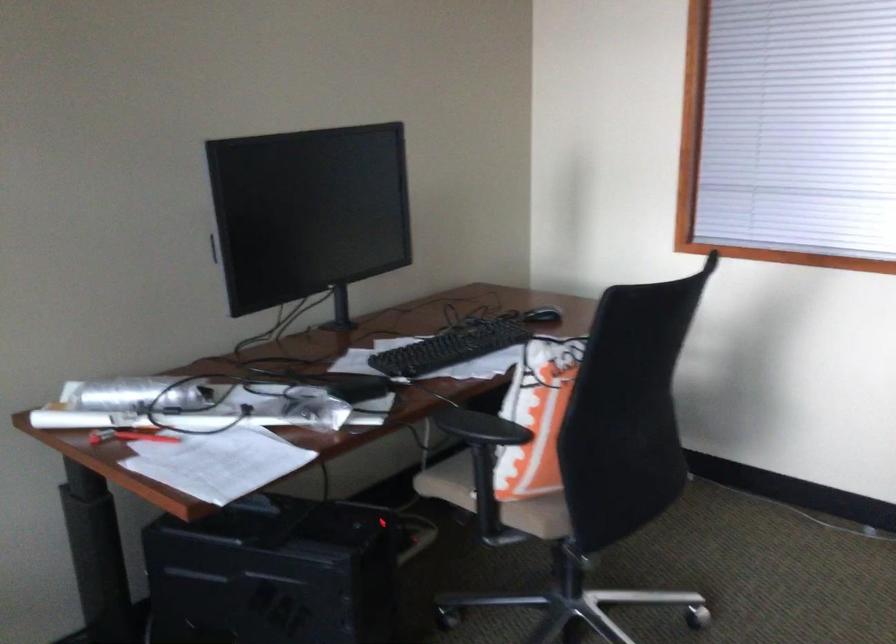
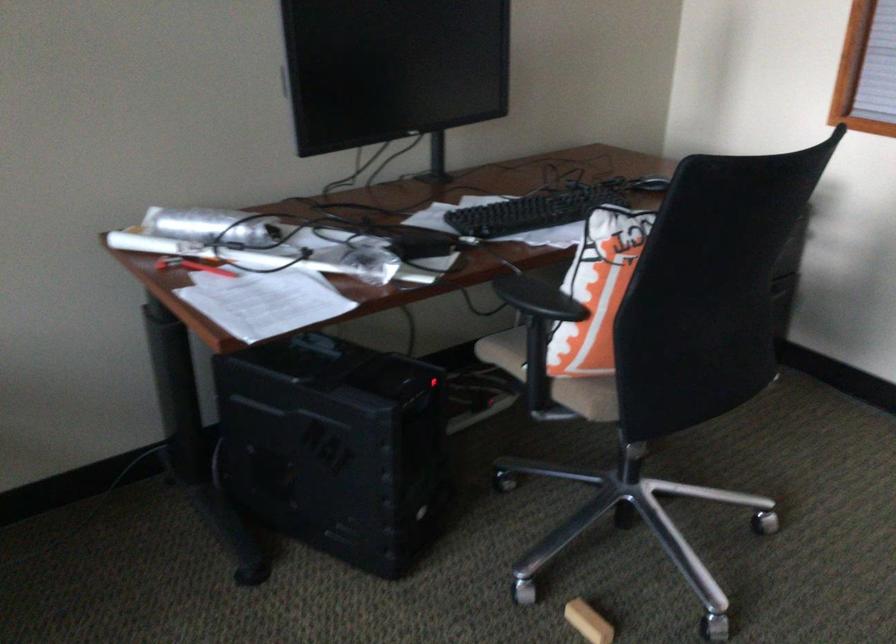
Where in the second image is the point corresponding to (x=545, y=316) from the first image?

(648, 185)